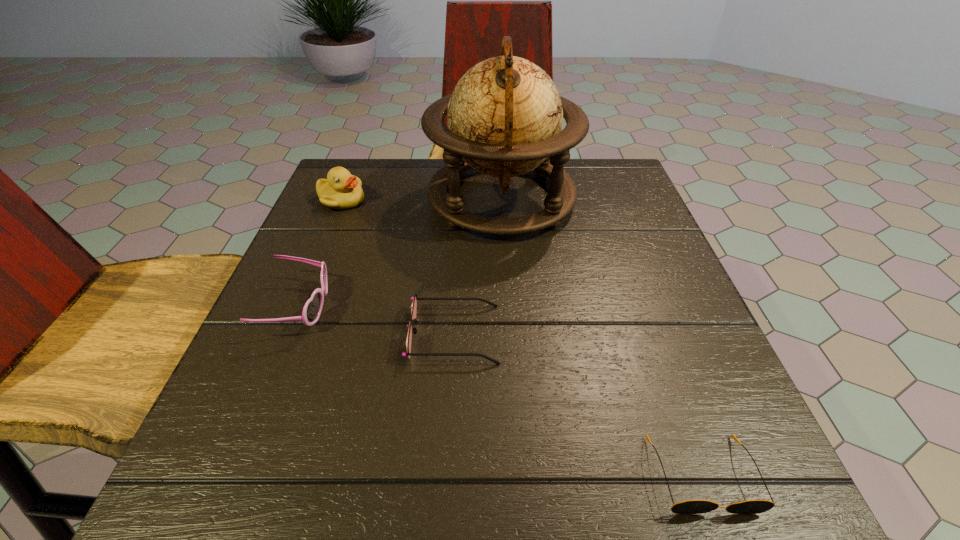
This screenshot has width=960, height=540. I want to click on globe, so click(505, 115).

Identify the location of duckling. The width and height of the screenshot is (960, 540). (341, 190).

Identify the location of the tallest sunglasses. The width and height of the screenshot is (960, 540). (311, 312).

Locate an element on the screen. The image size is (960, 540). the third tallest object is located at coordinates (311, 312).

At what (x,y) coordinates should I click in order to perform the action: click on the second sunglasses from left to right. Please return your answer as a coordinate pair (x, y). This screenshot has width=960, height=540. Looking at the image, I should click on (414, 304).

Where is `the rightmost object`? the rightmost object is located at coordinates (690, 506).

Find the location of `the rightmost sunglasses`. the rightmost sunglasses is located at coordinates (690, 506).

Image resolution: width=960 pixels, height=540 pixels. In order to click on vacant area situated on the right of the tallest object in this screenshot , I will do `click(633, 199)`.

Where is `vacant position located on the front-facing side of the duckling`? The width and height of the screenshot is (960, 540). vacant position located on the front-facing side of the duckling is located at coordinates (452, 200).

Locate an element on the screen. Image resolution: width=960 pixels, height=540 pixels. free region located 0.340m on the front-facing side of the third shortest object is located at coordinates (516, 307).